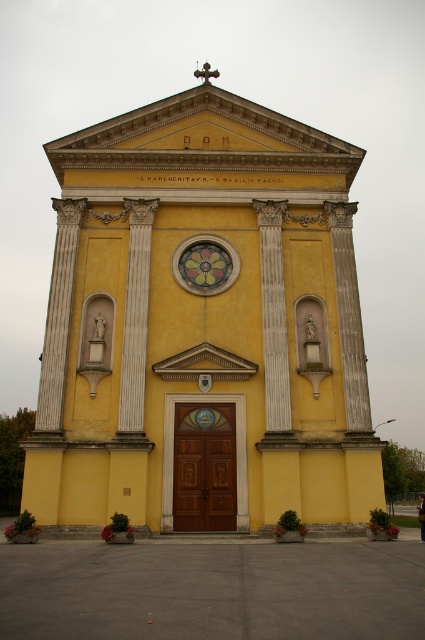
Question: Is yellow matte church at center bigger than stained glass window at center?

Choices:
 (A) yes
 (B) no

Answer: (A)

Question: Can you confirm if yellow matte church at center is positioned to the left of stained glass window at center?

Choices:
 (A) no
 (B) yes

Answer: (A)

Question: Which of the following is the closest to the observer?

Choices:
 (A) yellow matte church at center
 (B) stained glass window at center

Answer: (A)

Question: Does yellow matte church at center have a smaller size compared to stained glass window at center?

Choices:
 (A) no
 (B) yes

Answer: (A)